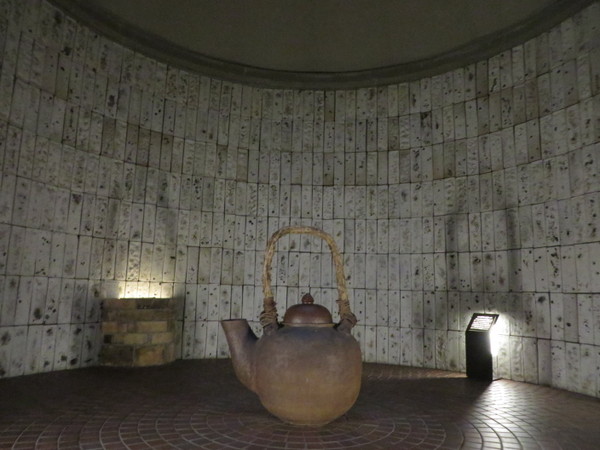
Where is `kettle tea on spout`? Image resolution: width=600 pixels, height=450 pixels. kettle tea on spout is located at coordinates (241, 340).